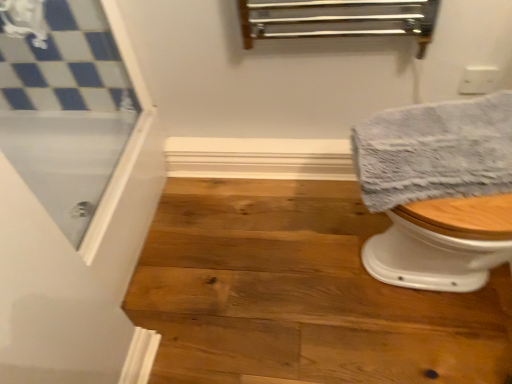
Question: In the image, is natural wood stair at lower right positioned in front of or behind clear glass screen door at upper left?

Choices:
 (A) behind
 (B) front

Answer: (A)

Question: In terms of height, does natural wood stair at lower right look taller or shorter compared to clear glass screen door at upper left?

Choices:
 (A) short
 (B) tall

Answer: (A)

Question: Which is nearer to the natural wood stair at lower right?

Choices:
 (A) clear glass screen door at upper left
 (B) gray textured towel at right

Answer: (B)

Question: Which object is positioned closest to the gray textured towel at right?

Choices:
 (A) natural wood stair at lower right
 (B) clear glass screen door at upper left

Answer: (A)